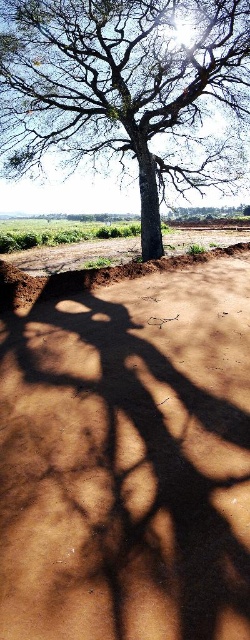
Question: Does brown sandy soil at center appear over smooth bark tree at center?

Choices:
 (A) no
 (B) yes

Answer: (A)

Question: Is brown sandy soil at center to the left of smooth bark tree at center from the viewer's perspective?

Choices:
 (A) no
 (B) yes

Answer: (B)

Question: Which object is farther from the camera taking this photo?

Choices:
 (A) smooth bark tree at center
 (B) brown sandy soil at center

Answer: (A)

Question: Which of the following is the farthest from the observer?

Choices:
 (A) [76, 112]
 (B) [120, 580]

Answer: (A)

Question: Does brown sandy soil at center appear on the right side of smooth bark tree at center?

Choices:
 (A) yes
 (B) no

Answer: (B)

Question: Which point is farther from the camera taking this photo?

Choices:
 (A) (109, 109)
 (B) (214, 419)

Answer: (A)